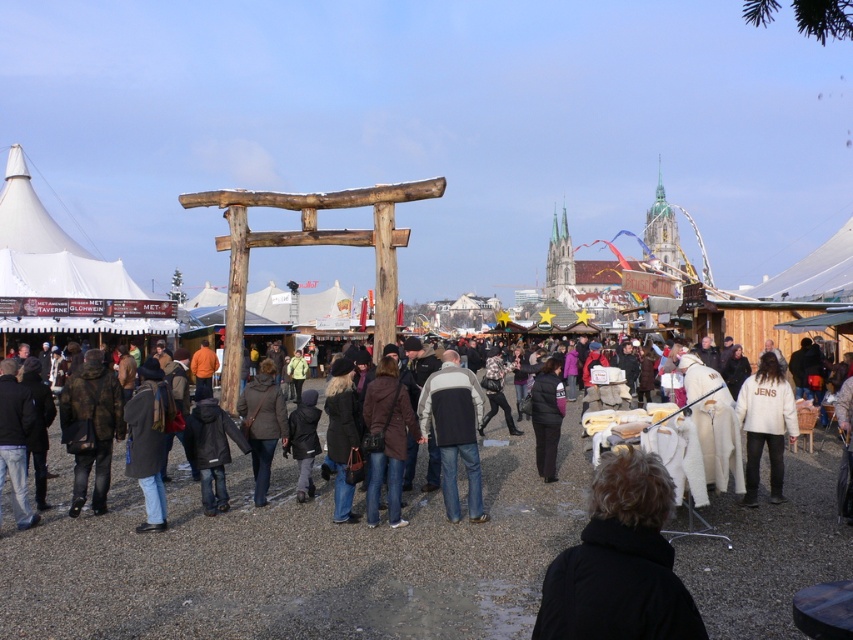
Is point (685, 616) positioned after point (740, 413)?

No, it is not.

The width and height of the screenshot is (853, 640). Find the location of `black woolen coat at center`. black woolen coat at center is located at coordinates (619, 563).

Image resolution: width=853 pixels, height=640 pixels. In order to click on black woolen coat at center in this screenshot , I will do `click(619, 563)`.

Does gray matte jacket at center have a lesser width compared to white fleece jacket at right?

Yes.

Is gray matte jacket at center shorter than white fleece jacket at right?

No, gray matte jacket at center is not shorter than white fleece jacket at right.

What do you see at coordinates (454, 429) in the screenshot? I see `gray matte jacket at center` at bounding box center [454, 429].

Where is `gray matte jacket at center`? gray matte jacket at center is located at coordinates (454, 429).

Is white fleece jacket at right smaller than black matte coat at center?

Incorrect, white fleece jacket at right is not smaller in size than black matte coat at center.

Is point (750, 483) behind point (554, 362)?

That is False.

Where is `white fleece jacket at right`? white fleece jacket at right is located at coordinates (764, 424).